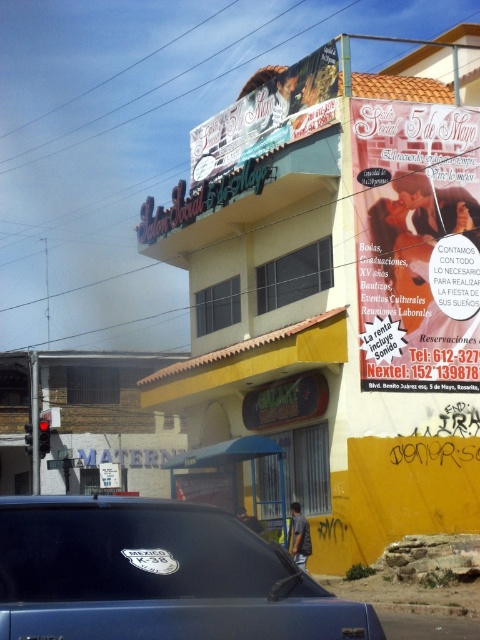
This screenshot has width=480, height=640. What do you see at coordinates (156, 576) in the screenshot? I see `metallic blue car at lower center` at bounding box center [156, 576].

Is point (142, 588) positioned in front of point (20, 637)?

No.

Locate an element on the screen. metallic blue car at lower center is located at coordinates (x=156, y=576).

This screenshot has width=480, height=640. Identify the location of metallic blue car at lower center. (156, 576).

Is point (208, 634) positioned after point (424, 152)?

No, (208, 634) is in front of (424, 152).

Find the location of a particular element. The width and height of the screenshot is (480, 640). metallic blue car at lower center is located at coordinates (156, 576).

Is matte pink sign at upper right below white plastic license plate at lower center?

Incorrect, matte pink sign at upper right is not positioned below white plastic license plate at lower center.

Is point (434, 189) positioned before point (43, 634)?

No, (434, 189) is further to viewer.

At what (x,y) coordinates should I click in order to perform the action: click on matte pink sign at upper right. Please return your answer as a coordinate pair (x, y). Image resolution: width=480 pixels, height=640 pixels. Looking at the image, I should click on (417, 244).